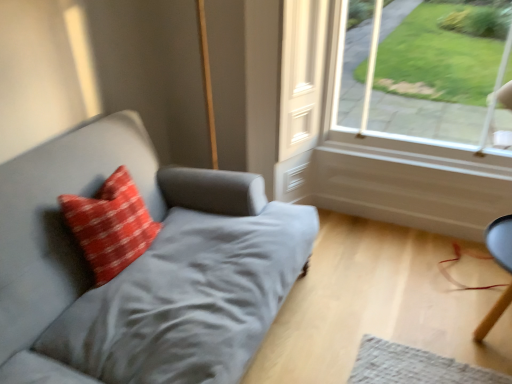
At what (x,y) coordinates should I click in order to perform the action: click on suede gray couch at left. Please return your answer as a coordinate pair (x, y). Looking at the image, I should click on (141, 267).

What do you see at coordinates (141, 267) in the screenshot?
I see `suede gray couch at left` at bounding box center [141, 267].

You are a GUI agent. You are given a task and a screenshot of the screen. Output one action in this format:
    pyautogui.click(x=<x>, y=<y>)
    Task: Click on the smooth black chair at lower right
    This screenshot has width=512, height=384.
    Given the screenshot: What is the action you would take?
    pyautogui.click(x=501, y=241)

Between point (75, 214) and point (22, 248), which one is positioned behind?

The point (75, 214) is farther.

Considering the sizes of objects red textured pillow at left and suede gray couch at left in the image provided, who is shorter, red textured pillow at left or suede gray couch at left?

red textured pillow at left is shorter.

Considering the relative sizes of red textured pillow at left and suede gray couch at left in the image provided, is red textured pillow at left bigger than suede gray couch at left?

No.

From the image's perspective, between suede gray couch at left and red textured pillow at left, who is located below?

suede gray couch at left, from the image's perspective.

Could you tell me if suede gray couch at left is turned towards red textured pillow at left?

Yes.

From a real-world perspective, which object stands above the other?

From a 3D spatial view, red textured pillow at left is above.

Are suede gray couch at left and red textured pillow at left making contact?

No, suede gray couch at left is not touching red textured pillow at left.

Considering the sizes of objects red textured pillow at left and clear glass window at upper right in the image provided, who is wider, red textured pillow at left or clear glass window at upper right?

Wider between the two is red textured pillow at left.

Considering the sizes of objects red textured pillow at left and clear glass window at upper right in the image provided, who is bigger, red textured pillow at left or clear glass window at upper right?

With larger size is clear glass window at upper right.

Does red textured pillow at left appear on the right side of clear glass window at upper right?

Incorrect, red textured pillow at left is not on the right side of clear glass window at upper right.

Which is correct: red textured pillow at left is inside smooth black chair at lower right, or outside of it?

red textured pillow at left cannot be found inside smooth black chair at lower right.

What's the angular difference between red textured pillow at left and smooth black chair at lower right's facing directions?

The angle between the facing direction of red textured pillow at left and the facing direction of smooth black chair at lower right is 88 degrees.

Is red textured pillow at left wider than smooth black chair at lower right?

Incorrect, the width of red textured pillow at left does not surpass that of smooth black chair at lower right.

Find the location of `computer chair behind the red textured pillow at left`. computer chair behind the red textured pillow at left is located at coordinates (501, 241).

In the scene shown: Would you say suede gray couch at left is a long distance from clear glass window at upper right?

Indeed, suede gray couch at left is not near clear glass window at upper right.

Which is behind, suede gray couch at left or clear glass window at upper right?

clear glass window at upper right is further from the camera.

Between point (11, 255) and point (369, 39), which one is positioned behind?

Positioned behind is point (369, 39).

Is clear glass window at upper right placed right next to smooth black chair at lower right?

No, clear glass window at upper right is not next to smooth black chair at lower right.

From the image's perspective, between clear glass window at upper right and smooth black chair at lower right, which one is located above?

clear glass window at upper right appears higher in the image.

Locate an element on the screen. The height and width of the screenshot is (384, 512). computer chair lying below the clear glass window at upper right (from the image's perspective) is located at coordinates (501, 241).

Considering the relative sizes of clear glass window at upper right and smooth black chair at lower right in the image provided, is clear glass window at upper right smaller than smooth black chair at lower right?

Actually, clear glass window at upper right might be larger than smooth black chair at lower right.

Would you consider suede gray couch at left to be distant from smooth black chair at lower right?

Absolutely, suede gray couch at left is distant from smooth black chair at lower right.

How far apart are suede gray couch at left and smooth black chair at lower right?

suede gray couch at left and smooth black chair at lower right are 1.52 meters apart from each other.

Who is shorter, suede gray couch at left or smooth black chair at lower right?

Standing shorter between the two is smooth black chair at lower right.

Looking at the image, does suede gray couch at left seem bigger or smaller compared to smooth black chair at lower right?

Considering their sizes, suede gray couch at left takes up more space than smooth black chair at lower right.

Where is `studio couch below the red textured pillow at left (from a real-world perspective)`? This screenshot has height=384, width=512. studio couch below the red textured pillow at left (from a real-world perspective) is located at coordinates (141, 267).

The width and height of the screenshot is (512, 384). Find the location of `pillow above the suede gray couch at left (from a real-world perspective)`. pillow above the suede gray couch at left (from a real-world perspective) is located at coordinates (110, 225).

Which object lies nearer to the anchor point suede gray couch at left, smooth black chair at lower right or clear glass window at upper right?

clear glass window at upper right is positioned closer to the anchor suede gray couch at left.

When comparing their distances from smooth black chair at lower right, does clear glass window at upper right or red textured pillow at left seem closer?

clear glass window at upper right.

When comparing their distances from suede gray couch at left, does red textured pillow at left or clear glass window at upper right seem further?

The object further to suede gray couch at left is clear glass window at upper right.

Based on the photo, considering their positions, is suede gray couch at left positioned further to clear glass window at upper right than red textured pillow at left?

Among the two, red textured pillow at left is located further to clear glass window at upper right.

Based on their spatial positions, is red textured pillow at left or suede gray couch at left further from clear glass window at upper right?

red textured pillow at left is positioned further to the anchor clear glass window at upper right.

Considering their positions, is suede gray couch at left positioned closer to smooth black chair at lower right than clear glass window at upper right?

clear glass window at upper right is positioned closer to the anchor smooth black chair at lower right.

When comparing their distances from red textured pillow at left, does smooth black chair at lower right or suede gray couch at left seem closer?

suede gray couch at left is closer to red textured pillow at left.

Estimate the real-world distances between objects in this image. Which object is further from red textured pillow at left, clear glass window at upper right or smooth black chair at lower right?

smooth black chair at lower right.

Identify the location of studio couch between red textured pillow at left and clear glass window at upper right. The image size is (512, 384). (141, 267).

Image resolution: width=512 pixels, height=384 pixels. I want to click on window between red textured pillow at left and smooth black chair at lower right from left to right, so click(x=425, y=120).

This screenshot has width=512, height=384. In order to click on studio couch between red textured pillow at left and smooth black chair at lower right in the horizontal direction in this screenshot , I will do `click(141, 267)`.

Where is `window between suede gray couch at left and smooth black chair at lower right from left to right`? This screenshot has width=512, height=384. window between suede gray couch at left and smooth black chair at lower right from left to right is located at coordinates (425, 120).